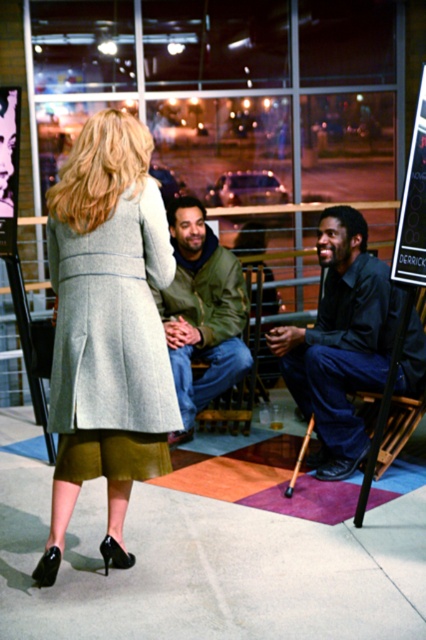
You are a fashion designer observing the scene. You need to determine which item of clothing is more suitable for a petite figure. Based on the sizes of the light gray wool coat at center and the dark blue jeans at lower right, which one would you recommend?

The light gray wool coat at center has a smaller size compared to the dark blue jeans at lower right, so it would be more suitable for a petite figure.

You are a fashion designer observing the scene. You notice two coats in the image. Which coat is positioned lower in the image, the matte gray coat at center or the light gray wool coat at center?

The matte gray coat at center is located below the light gray wool coat at center, so the matte gray coat at center is positioned lower in the image.